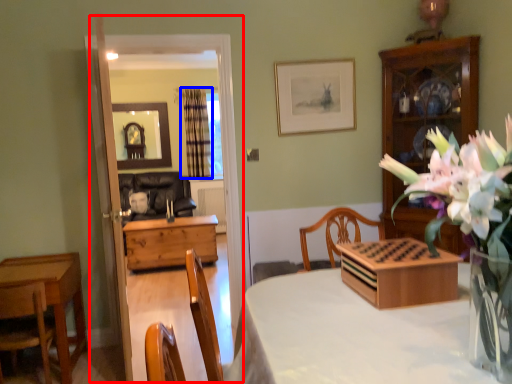
Question: Which object appears farthest to the camera in this image, glass door (highlighted by a red box) or curtain (highlighted by a blue box)?

Choices:
 (A) glass door
 (B) curtain

Answer: (B)